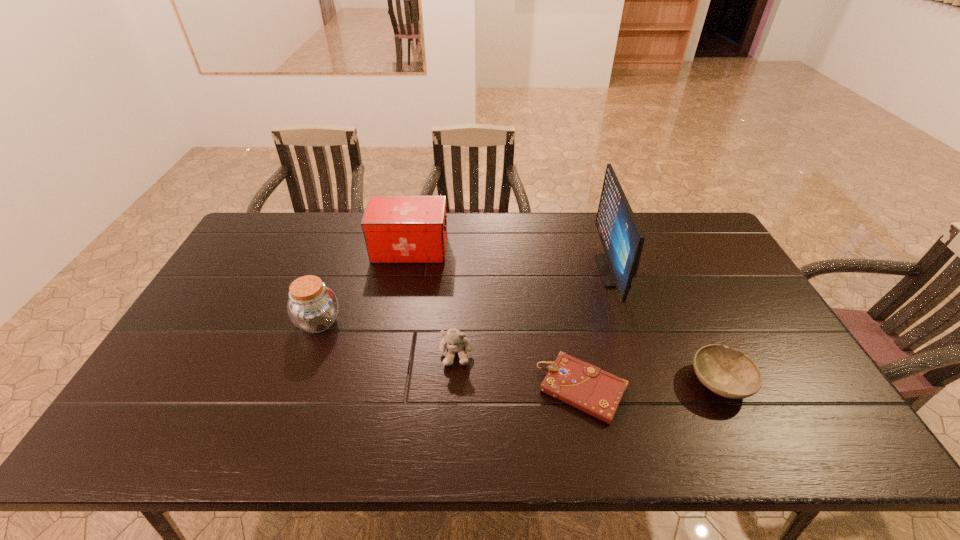
Locate an element on the screen. This screenshot has width=960, height=540. object that is positioned at the near edge is located at coordinates (582, 385).

This screenshot has height=540, width=960. Find the location of `object that is positioned at the right edge`. object that is positioned at the right edge is located at coordinates (730, 373).

You are a GUI agent. You are given a task and a screenshot of the screen. Output one action in this format:
    pyautogui.click(x=<x>, y=<y>)
    Task: Click on the vacant space at the far edge of the desktop
    
    Given the screenshot: What is the action you would take?
    pyautogui.click(x=471, y=232)

The image size is (960, 540). Find the location of `vacant region at the left edge of the desktop`. vacant region at the left edge of the desktop is located at coordinates (272, 274).

The width and height of the screenshot is (960, 540). I want to click on free space at the right edge, so click(x=797, y=393).

I want to click on free spot at the far left corner of the desktop, so click(x=291, y=220).

In the image, there is a desktop. Where is `blank space at the near left corner`? The height and width of the screenshot is (540, 960). blank space at the near left corner is located at coordinates (172, 427).

The width and height of the screenshot is (960, 540). Find the location of `vacant region at the far right corner of the desktop`. vacant region at the far right corner of the desktop is located at coordinates (671, 223).

Locate an element on the screen. The image size is (960, 540). free spot between the fifth tallest object and the notebook is located at coordinates (651, 386).

I want to click on free space between the fifth object from left to right and the fourth tallest object, so click(x=534, y=312).